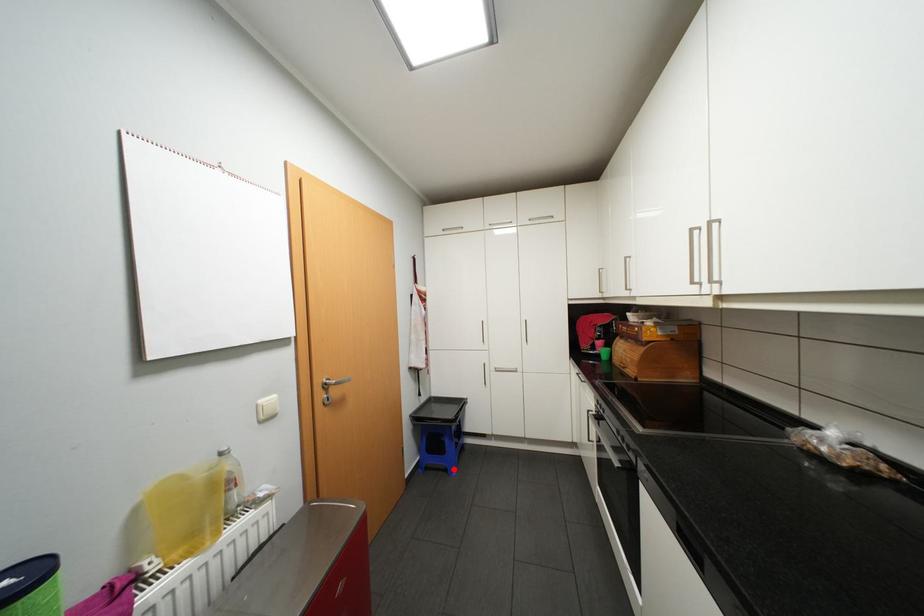
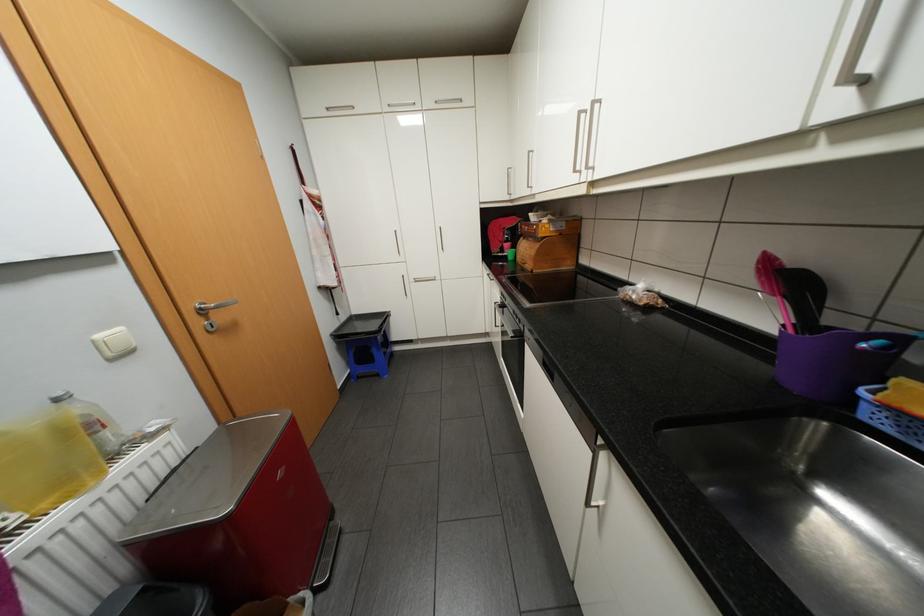
Question: I am providing you with two images of the same scene from different viewpoints. Image1 has a red point marked. In image2, the corresponding 3D location appears at what relative position? Reply with the corresponding letter.

Choices:
 (A) Closer
 (B) Farther

Answer: (A)